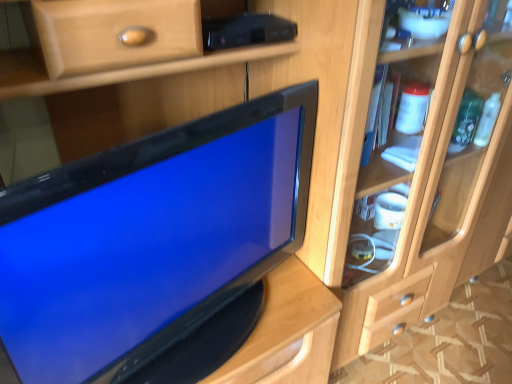
In order to click on light wood cabinet at right in this screenshot , I will do `click(429, 187)`.

This screenshot has width=512, height=384. What do you see at coordinates (429, 187) in the screenshot? I see `light wood cabinet at right` at bounding box center [429, 187].

What is the approximate height of matte black tv at center?

matte black tv at center is 58.67 centimeters in height.

What do you see at coordinates (155, 247) in the screenshot? I see `matte black tv at center` at bounding box center [155, 247].

Where is `matte black tv at center`? matte black tv at center is located at coordinates (155, 247).

Find the location of `light wood cabinet at right`. light wood cabinet at right is located at coordinates (429, 187).

Considering the positions of objects light wood cabinet at right and matte black tv at center in the image provided, who is more to the right, light wood cabinet at right or matte black tv at center?

Positioned to the right is light wood cabinet at right.

Does light wood cabinet at right lie in front of matte black tv at center?

No, light wood cabinet at right is behind matte black tv at center.

Does point (443, 59) come closer to viewer compared to point (53, 328)?

No, (443, 59) is further to viewer.

From the image's perspective, between light wood cabinet at right and matte black tv at center, who is located below?

matte black tv at center.

From a real-world perspective, is light wood cabinet at right below matte black tv at center?

Yes, from a real-world perspective, light wood cabinet at right is beneath matte black tv at center.

Based on the photo, does light wood cabinet at right have a lesser width compared to matte black tv at center?

Incorrect, the width of light wood cabinet at right is not less than that of matte black tv at center.

Can you confirm if light wood cabinet at right is taller than matte black tv at center?

Correct, light wood cabinet at right is much taller as matte black tv at center.

Considering the sizes of light wood cabinet at right and matte black tv at center in the image, is light wood cabinet at right bigger or smaller than matte black tv at center?

Considering their sizes, light wood cabinet at right takes up more space than matte black tv at center.

Do you think light wood cabinet at right is within matte black tv at center, or outside of it?

light wood cabinet at right lies outside matte black tv at center.

Looking at this image, is light wood cabinet at right not near matte black tv at center?

light wood cabinet at right is near matte black tv at center, not far away.

Is light wood cabinet at right positioned with its back to matte black tv at center?

No, light wood cabinet at right is not facing away from matte black tv at center.

How far apart are light wood cabinet at right and matte black tv at center?

light wood cabinet at right and matte black tv at center are 18.82 inches apart.

Locate an element on the screen. Image resolution: width=512 pixels, height=384 pixels. television located above the light wood cabinet at right (from a real-world perspective) is located at coordinates (155, 247).

In the image, is matte black tv at center on the left side or the right side of light wood cabinet at right?

From the image, it's evident that matte black tv at center is to the left of light wood cabinet at right.

Is the depth of matte black tv at center less than that of light wood cabinet at right?

Yes, matte black tv at center is closer to the viewer.

Does point (199, 348) come behind point (425, 51)?

No, it is in front of (425, 51).

From the image's perspective, between matte black tv at center and light wood cabinet at right, which one is located above?

light wood cabinet at right.

From a real-world perspective, is matte black tv at center positioned above or below light wood cabinet at right?

Clearly, from a real-world perspective, matte black tv at center is above light wood cabinet at right.

Does matte black tv at center have a greater width compared to light wood cabinet at right?

Incorrect, the width of matte black tv at center does not surpass that of light wood cabinet at right.

Between matte black tv at center and light wood cabinet at right, which one has less height?

Standing shorter between the two is matte black tv at center.

Looking at the image, does matte black tv at center seem bigger or smaller compared to light wood cabinet at right?

Considering their sizes, matte black tv at center takes up less space than light wood cabinet at right.

Is light wood cabinet at right inside matte black tv at center?

Definitely not — light wood cabinet at right is not inside matte black tv at center.

Is matte black tv at center far away from light wood cabinet at right?

They are positioned close to each other.

Is matte black tv at center facing towards light wood cabinet at right?

No.

What's the angular difference between matte black tv at center and light wood cabinet at right's facing directions?

15.1 degrees separate the facing orientations of matte black tv at center and light wood cabinet at right.

The height and width of the screenshot is (384, 512). Find the location of `dresser behind the matte black tv at center`. dresser behind the matte black tv at center is located at coordinates (429, 187).

The height and width of the screenshot is (384, 512). Identify the location of television on the left of light wood cabinet at right. [x=155, y=247].

Identify the location of television lying below the light wood cabinet at right (from the image's perspective). This screenshot has height=384, width=512. (155, 247).